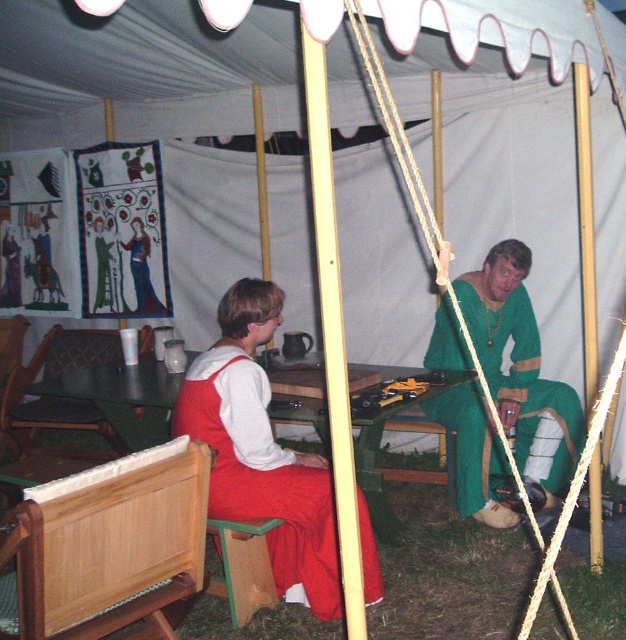
You are setting up a small table inside the tent for a medieval event. You have a wooden chair at center and a green fabric dress at center. Which object should you move first to make space for the table?

The wooden chair at center should be moved first because it is smaller than the green fabric dress at center, making it easier to relocate to create space for the table.

You are a guest entering the tent and want to sit down. Which object, the wooden chair at center or the wooden table at center, will you need to adjust your height to use comfortably?

The wooden chair at center is taller than the wooden table at center. To sit comfortably, you would need to adjust your height to match the chair, as it is higher than the table.

You are setting up a small table inside the tent for a medieval feast. You have a wooden chair at center and a green fabric dress at center. Which object should you move to make space for a serving platter?

The wooden chair at center is thinner than the green fabric dress at center, so you should move the green fabric dress at center to make more space for the serving platter.